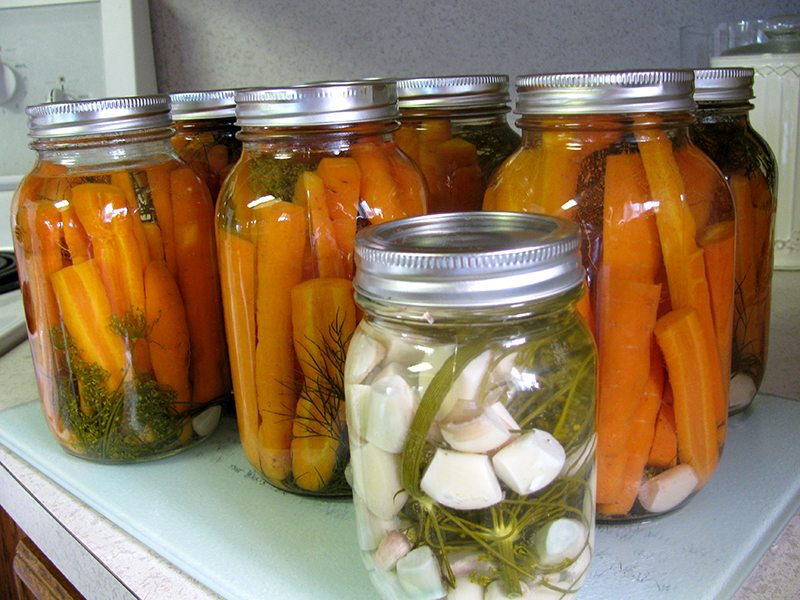
At what (x,y) coordinates should I click in order to perform the action: click on wall. Please return your answer as a coordinate pair (x, y). This screenshot has width=800, height=600. Looking at the image, I should click on (420, 44).